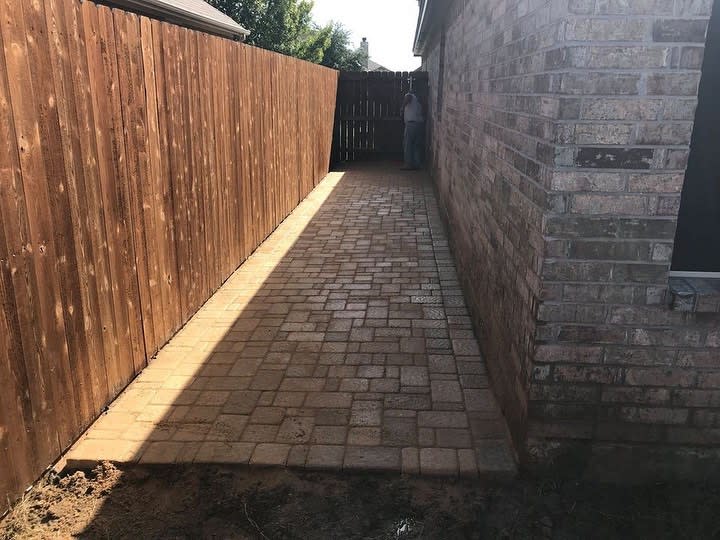
Where is `chimney`? This screenshot has height=540, width=720. chimney is located at coordinates (363, 47).